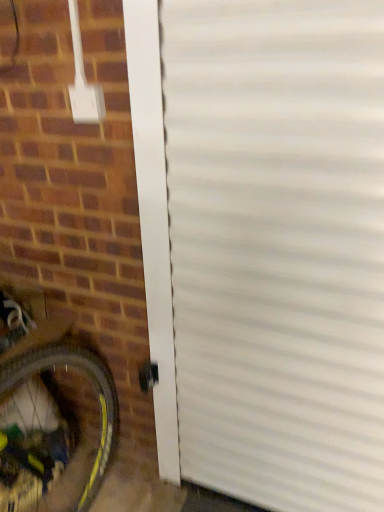
Question: Is brown brick at lower left taller than white corrugated door at center?

Choices:
 (A) no
 (B) yes

Answer: (A)

Question: Is brown brick at lower left at the right side of white corrugated door at center?

Choices:
 (A) no
 (B) yes

Answer: (A)

Question: From a real-world perspective, is brown brick at lower left located higher than white corrugated door at center?

Choices:
 (A) no
 (B) yes

Answer: (A)

Question: Is brown brick at lower left facing towards white corrugated door at center?

Choices:
 (A) no
 (B) yes

Answer: (B)

Question: Is brown brick at lower left not near white corrugated door at center?

Choices:
 (A) yes
 (B) no

Answer: (B)

Question: In terms of height, does yellow rubber bicycle wheel at lower left look taller or shorter compared to brown brick at lower left?

Choices:
 (A) tall
 (B) short

Answer: (B)

Question: In terms of size, does yellow rubber bicycle wheel at lower left appear bigger or smaller than brown brick at lower left?

Choices:
 (A) small
 (B) big

Answer: (A)

Question: Considering the positions of point pyautogui.click(x=31, y=394) and point pyautogui.click(x=135, y=320), is point pyautogui.click(x=31, y=394) closer or farther from the camera than point pyautogui.click(x=135, y=320)?

Choices:
 (A) closer
 (B) farther

Answer: (B)

Question: From the image's perspective, relative to brown brick at lower left, is yellow rubber bicycle wheel at lower left above or below?

Choices:
 (A) below
 (B) above

Answer: (A)

Question: Based on their sizes in the image, would you say brown brick at lower left is bigger or smaller than white corrugated door at center?

Choices:
 (A) big
 (B) small

Answer: (A)

Question: In terms of width, does brown brick at lower left look wider or thinner when compared to white corrugated door at center?

Choices:
 (A) thin
 (B) wide

Answer: (B)

Question: In terms of height, does brown brick at lower left look taller or shorter compared to white corrugated door at center?

Choices:
 (A) short
 (B) tall

Answer: (A)

Question: From a real-world perspective, is brown brick at lower left above or below white corrugated door at center?

Choices:
 (A) above
 (B) below

Answer: (B)

Question: Based on their positions, is white corrugated door at center located to the left or right of brown brick at lower left?

Choices:
 (A) left
 (B) right

Answer: (B)

Question: From the image's perspective, is white corrugated door at center positioned above or below brown brick at lower left?

Choices:
 (A) below
 (B) above

Answer: (B)